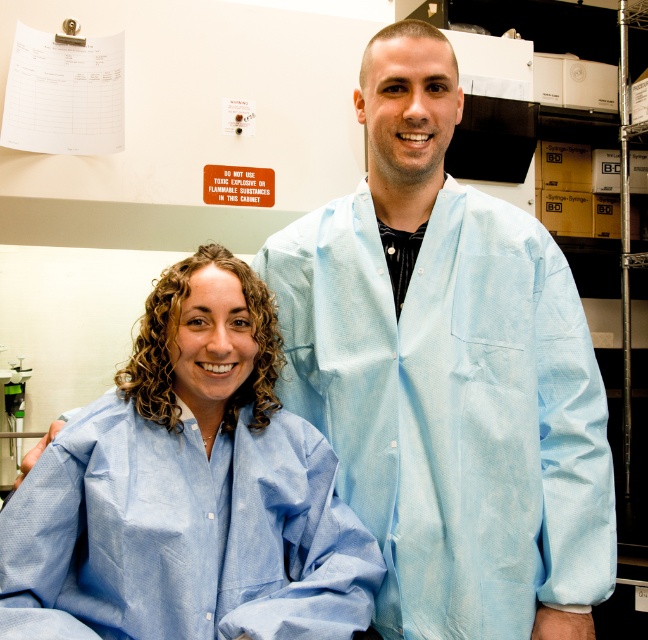
Who is positioned more to the right, light blue fabric lab coat at center or light blue fabric at center?

light blue fabric lab coat at center

Between point (494, 516) and point (148, 340), which one is positioned behind?

Positioned behind is point (494, 516).

Find the location of a particular element. light blue fabric lab coat at center is located at coordinates (446, 374).